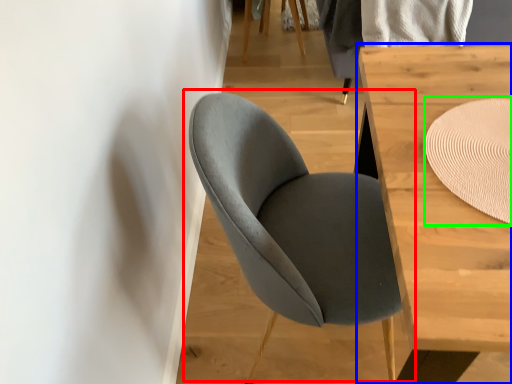
Question: Considering the real-world distances, which object is farthest from chair (highlighted by a red box)? table (highlighted by a blue box) or mat (highlighted by a green box)?

Choices:
 (A) table
 (B) mat

Answer: (B)